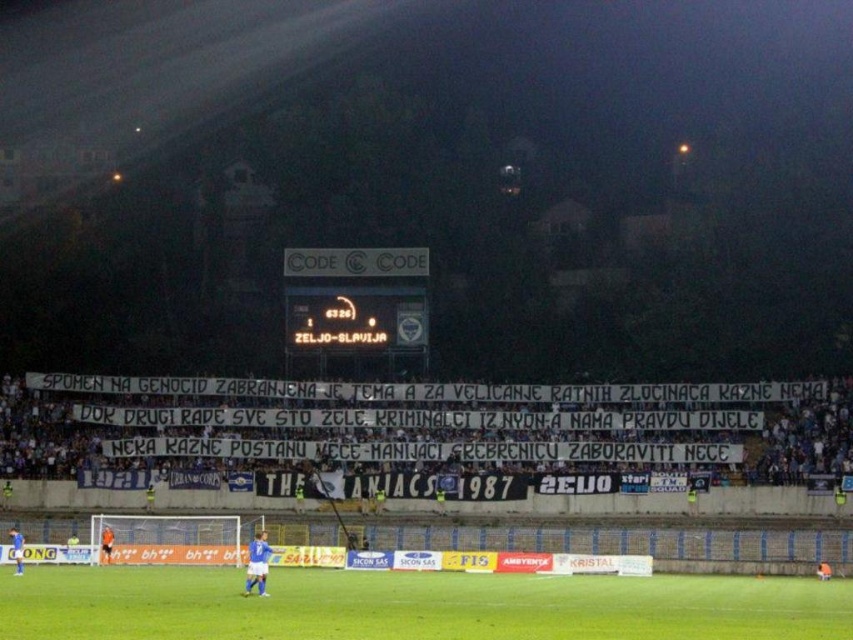
Is white fabric banner at center wider than green grass field at center?

Yes.

Which of these two, white fabric banner at center or green grass field at center, stands taller?

With more height is white fabric banner at center.

Which is in front, point (338, 410) or point (706, 616)?

Point (706, 616) is in front.

I want to click on white fabric banner at center, so click(x=410, y=440).